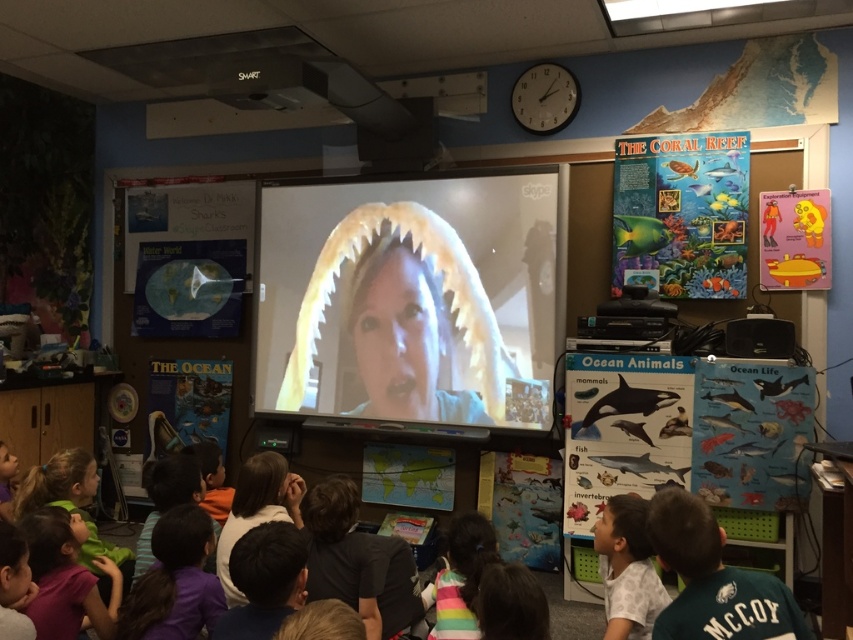
You are a student sitting at the back of the classroom and want to see the matte plastic screen at center clearly. Considering your position, where should you look to focus your gaze?

You should focus your gaze directly at the matte plastic screen at center located at point [410,298] to see it clearly.

You are a student sitting in the classroom and need to decide which object, the matte plastic screen at center or the green jersey at lower right, you can see more of from your seat. Which one would it be?

The matte plastic screen at center has a larger width than the green jersey at lower right, so you can see more of the matte plastic screen at center from your seat.

You are a student in the classroom who wants to whisper to your friend wearing the white matte shirt at lower right without being noticed by the teacher, who is standing near the matte plastic screen at center. Can you move closer to the friend without the teacher seeing you, given that the teacher can see 2 meters in all directions?

The distance between the matte plastic screen at center and the white matte shirt at lower right is 1.74 meters. Since the teacher can see 2 meters around them, moving closer to the white matte shirt at lower right would still keep you within the teacher s visible range. Therefore, the teacher would still see you if you move closer.